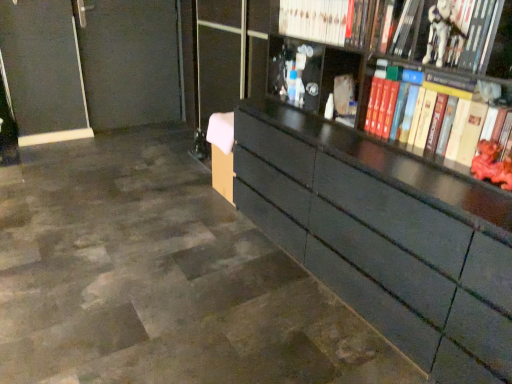
What is the approximate width of white plastic toy at upper right, which is counted as the second toy, starting from the bottom?

white plastic toy at upper right, which is counted as the second toy, starting from the bottom, is 4.30 inches wide.

This screenshot has height=384, width=512. Find the location of `white plastic toy at upper right, placed as the first toy when sorted from left to right`. white plastic toy at upper right, placed as the first toy when sorted from left to right is located at coordinates (439, 30).

Describe the element at coordinates (492, 165) in the screenshot. The height and width of the screenshot is (384, 512). I see `rubberized red toy at right, the first toy in the right-to-left sequence` at that location.

The height and width of the screenshot is (384, 512). Describe the element at coordinates (218, 70) in the screenshot. I see `transparent glass door at center` at that location.

This screenshot has height=384, width=512. What are the coordinates of `transparent glass door at center` in the screenshot? It's located at (218, 70).

At what (x,y) coordinates should I click in order to perform the action: click on white plastic toy at upper right, which appears as the first toy when viewed from the top. Please return your answer as a coordinate pair (x, y). Looking at the image, I should click on (439, 30).

How far apart are hardcover book at upper right, acting as the 3th book starting from the bottom, and white plastic toy at upper right, placed as the first toy when sorted from left to right?

hardcover book at upper right, acting as the 3th book starting from the bottom, is 5.37 inches from white plastic toy at upper right, placed as the first toy when sorted from left to right.

Who is bigger, hardcover book at upper right, acting as the 3th book starting from the bottom, or white plastic toy at upper right, placed as the first toy when sorted from left to right?

Bigger between the two is hardcover book at upper right, acting as the 3th book starting from the bottom.

From the image's perspective, which is below, hardcover book at upper right, acting as the 3th book starting from the bottom, or white plastic toy at upper right, the second toy viewed from the right?

white plastic toy at upper right, the second toy viewed from the right, from the image's perspective.

Is hardcover book at upper right, positioned as the second book in top-to-bottom order, situated inside white plastic toy at upper right, the second toy viewed from the right, or outside?

hardcover book at upper right, positioned as the second book in top-to-bottom order, is not inside white plastic toy at upper right, the second toy viewed from the right, it's outside.

Between white plastic toy at upper right, acting as the 2th book starting from the bottom, and hardcover book at right, acting as the 4th book starting from the top, which one is positioned behind?

white plastic toy at upper right, acting as the 2th book starting from the bottom, is more distant.

Who is taller, white plastic toy at upper right, which ranks as the 3th book in top-to-bottom order, or hardcover book at right, the first book when ordered from bottom to top?

hardcover book at right, the first book when ordered from bottom to top, is taller.

Consider the image. Can you confirm if white plastic toy at upper right, acting as the 2th book starting from the bottom, is bigger than hardcover book at right, acting as the 4th book starting from the top?

No.

Where is `the 2nd book positioned below the white plastic toy at upper right, acting as the 2th book starting from the bottom (from a real-world perspective)`? The height and width of the screenshot is (384, 512). the 2nd book positioned below the white plastic toy at upper right, acting as the 2th book starting from the bottom (from a real-world perspective) is located at coordinates click(x=430, y=111).

Starting from the transparent glass door at center, which book is the 2nd one in front? Please provide its 2D coordinates.

[(400, 30)]

How different are the orientations of hardcover book at upper right, positioned as the second book in top-to-bottom order, and transparent glass door at center in degrees?

The angular difference between hardcover book at upper right, positioned as the second book in top-to-bottom order, and transparent glass door at center is 3.73 degrees.

Could you tell me if hardcover book at upper right, positioned as the second book in top-to-bottom order, is facing transparent glass door at center?

No, hardcover book at upper right, positioned as the second book in top-to-bottom order, is not facing towards transparent glass door at center.

From the image's perspective, relative to transparent glass door at center, is hardcover book at upper right, acting as the 3th book starting from the bottom, above or below?

Based on their image positions, hardcover book at upper right, acting as the 3th book starting from the bottom, is located beneath transparent glass door at center.

From the image's perspective, would you say transparent glass door at center is shown under hardcover book at right, the first book when ordered from bottom to top?

No.

Could you tell me if transparent glass door at center is facing hardcover book at right, the first book when ordered from bottom to top?

No, transparent glass door at center is not oriented towards hardcover book at right, the first book when ordered from bottom to top.

Is transparent glass door at center positioned beyond the bounds of hardcover book at right, the first book when ordered from bottom to top?

Absolutely, transparent glass door at center is external to hardcover book at right, the first book when ordered from bottom to top.

Which object is closer to the camera, transparent glass door at center or hardcover book at right, acting as the 4th book starting from the top?

hardcover book at right, acting as the 4th book starting from the top, is in front.

Considering the sizes of objects hardcover book at right, the first book when ordered from bottom to top, and hardcover book at upper right, acting as the 3th book starting from the bottom, in the image provided, who is bigger, hardcover book at right, the first book when ordered from bottom to top, or hardcover book at upper right, acting as the 3th book starting from the bottom,?

Bigger between the two is hardcover book at right, the first book when ordered from bottom to top.

Is hardcover book at right, the first book when ordered from bottom to top, aimed at hardcover book at upper right, positioned as the second book in top-to-bottom order?

No, hardcover book at right, the first book when ordered from bottom to top, does not turn towards hardcover book at upper right, positioned as the second book in top-to-bottom order.

Does hardcover book at right, the first book when ordered from bottom to top, lie in front of hardcover book at upper right, acting as the 3th book starting from the bottom?

Yes, it is.

From a real-world perspective, which is physically below, hardcover book at right, the first book when ordered from bottom to top, or hardcover book at upper right, positioned as the second book in top-to-bottom order?

In real-world perspective, hardcover book at right, the first book when ordered from bottom to top, is lower.

In terms of size, does transparent glass door at center appear bigger or smaller than white plastic toy at upper right, placed as the first toy when sorted from left to right?

transparent glass door at center is bigger than white plastic toy at upper right, placed as the first toy when sorted from left to right.

Which object is positioned more to the right, transparent glass door at center or white plastic toy at upper right, placed as the first toy when sorted from left to right?

white plastic toy at upper right, placed as the first toy when sorted from left to right, is more to the right.

Looking at this image, which of these two, transparent glass door at center or white plastic toy at upper right, the second toy viewed from the right, is thinner?

Thinner between the two is transparent glass door at center.

Does transparent glass door at center come in front of white plastic toy at upper right, placed as the first toy when sorted from left to right?

No, it is not.

Which is behind, point (469, 127) or point (482, 10)?

Positioned behind is point (469, 127).

Is the position of hardcover book at right, acting as the 4th book starting from the top, more distant than that of white plastic toy at upper right, acting as the 2th book starting from the bottom?

That is False.

Locate an element on the screen. The height and width of the screenshot is (384, 512). book on the right of hardcover book at right, acting as the 4th book starting from the top is located at coordinates 476,35.

Would you say hardcover book at right, acting as the 4th book starting from the top, is a long distance from white plastic toy at upper right, acting as the 2th book starting from the bottom?

hardcover book at right, acting as the 4th book starting from the top, is near white plastic toy at upper right, acting as the 2th book starting from the bottom, not far away.

In order to click on the 1st toy positioned below the hardcover book at upper right, acting as the 3th book starting from the bottom (from the image's perspective) in this screenshot , I will do `click(439, 30)`.

Where is `the 1st book behind the hardcover book at right, acting as the 4th book starting from the top, counting from the anchor's position`? The image size is (512, 384). the 1st book behind the hardcover book at right, acting as the 4th book starting from the top, counting from the anchor's position is located at coordinates (476, 35).

Estimate the real-world distances between objects in this image. Which object is further from rubberized red toy at right, which appears as the second toy when viewed from the top, white plastic toy at upper right, acting as the 2th book starting from the bottom, or hardcover book at right, acting as the 4th book starting from the top?

white plastic toy at upper right, acting as the 2th book starting from the bottom, is positioned further to the anchor rubberized red toy at right, which appears as the second toy when viewed from the top.

Based on their spatial positions, is transparent glass door at center or hardcover book at right, the first book when ordered from bottom to top, closer to rubberized red toy at right, the first toy in the right-to-left sequence?

hardcover book at right, the first book when ordered from bottom to top.

When comparing their distances from hardcover book at right, acting as the 4th book starting from the top, does hardcover book at upper right, positioned as the second book in top-to-bottom order, or white glossy book at upper center, the 4th book positioned from the bottom, seem closer?

hardcover book at upper right, positioned as the second book in top-to-bottom order.

Which object lies nearer to the anchor point white plastic toy at upper right, which is counted as the second toy, starting from the bottom, transparent glass door at center or hardcover book at upper right, acting as the 3th book starting from the bottom?

hardcover book at upper right, acting as the 3th book starting from the bottom, is closer to white plastic toy at upper right, which is counted as the second toy, starting from the bottom.

Considering their positions, is hardcover book at right, the first book when ordered from bottom to top, positioned closer to rubberized red toy at right, which appears as the second toy when viewed from the top, than white plastic toy at upper right, which is counted as the second toy, starting from the bottom?

hardcover book at right, the first book when ordered from bottom to top, is closer to rubberized red toy at right, which appears as the second toy when viewed from the top.

Considering their positions, is white glossy book at upper center, the 4th book positioned from the bottom, positioned closer to white plastic toy at upper right, placed as the first toy when sorted from left to right, than white plastic toy at upper right, which ranks as the 3th book in top-to-bottom order?

Among the two, white plastic toy at upper right, which ranks as the 3th book in top-to-bottom order, is located nearer to white plastic toy at upper right, placed as the first toy when sorted from left to right.

Estimate the real-world distances between objects in this image. Which object is closer to white plastic toy at upper right, acting as the 2th book starting from the bottom, white plastic toy at upper right, placed as the first toy when sorted from left to right, or hardcover book at right, the first book when ordered from bottom to top?

white plastic toy at upper right, placed as the first toy when sorted from left to right, lies closer to white plastic toy at upper right, acting as the 2th book starting from the bottom, than the other object.

Considering their positions, is white plastic toy at upper right, placed as the first toy when sorted from left to right, positioned further to hardcover book at upper right, acting as the 3th book starting from the bottom, than transparent glass door at center?

transparent glass door at center.

Identify the location of book between white plastic toy at upper right, which ranks as the 3th book in top-to-bottom order, and rubberized red toy at right, the 1th toy ordered from the bottom, in the up-down direction. Image resolution: width=512 pixels, height=384 pixels. (430, 111).

The width and height of the screenshot is (512, 384). What are the coordinates of `toy between white plastic toy at upper right, acting as the 2th book starting from the bottom, and rubberized red toy at right, which appears as the second toy when viewed from the top, from top to bottom` in the screenshot? It's located at (439, 30).

Identify the location of toy between hardcover book at upper right, acting as the 3th book starting from the bottom, and hardcover book at right, the first book when ordered from bottom to top, in the vertical direction. (439, 30).

Locate an element on the screen. The height and width of the screenshot is (384, 512). toy between hardcover book at upper right, acting as the 3th book starting from the bottom, and rubberized red toy at right, positioned as the 2th toy in left-to-right order, in the up-down direction is located at coordinates (439, 30).